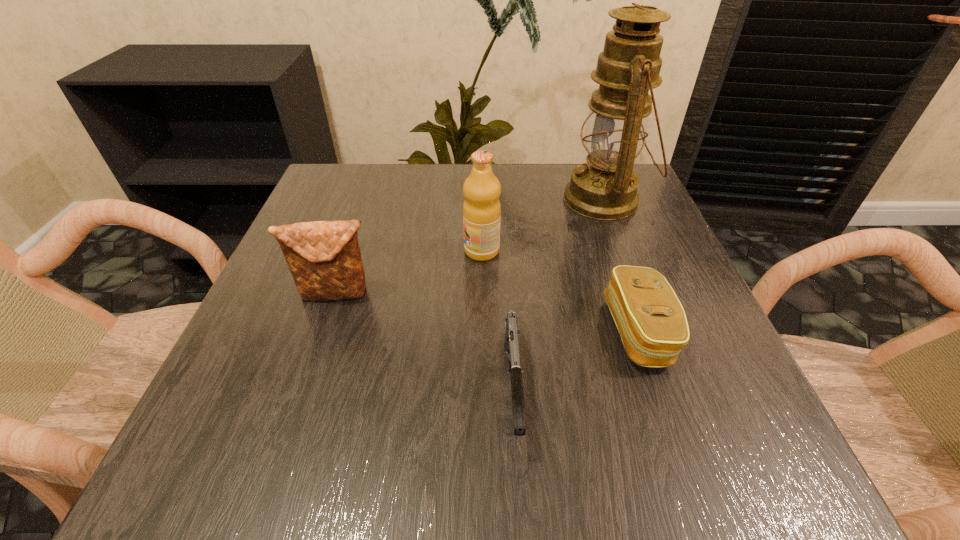
Image resolution: width=960 pixels, height=540 pixels. I want to click on blank space located 0.080m on the front label of the fruit juice, so [x=424, y=251].

Find the location of a particular element. free spot located on the front label of the fruit juice is located at coordinates (349, 251).

Locate an element on the screen. This screenshot has height=540, width=960. blank space located 0.260m on the open side of the third tallest object is located at coordinates (284, 451).

Locate an element on the screen. Image resolution: width=960 pixels, height=540 pixels. vacant space located 0.360m on the zipper side of the right clutch bag is located at coordinates (393, 332).

Locate an element on the screen. The width and height of the screenshot is (960, 540). free space located on the zipper side of the right clutch bag is located at coordinates (441, 332).

Where is `vacant region located 0.320m on the zipper side of the right clutch bag`? The height and width of the screenshot is (540, 960). vacant region located 0.320m on the zipper side of the right clutch bag is located at coordinates 417,332.

I want to click on object at the far edge, so click(604, 188).

Where is `object at the near edge`? The height and width of the screenshot is (540, 960). object at the near edge is located at coordinates (512, 332).

Locate an element on the screen. object located in the left edge section of the desktop is located at coordinates (324, 258).

Find the location of `oil lamp situated at the right edge`. oil lamp situated at the right edge is located at coordinates (604, 188).